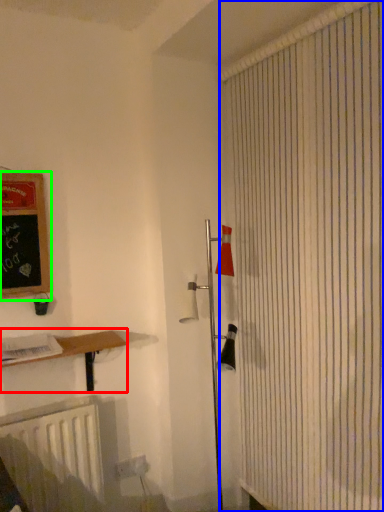
Question: Considering the real-world distances, which object is farthest from shelf (highlighted by a red box)? shower curtain (highlighted by a blue box) or bulletin board (highlighted by a green box)?

Choices:
 (A) shower curtain
 (B) bulletin board

Answer: (A)